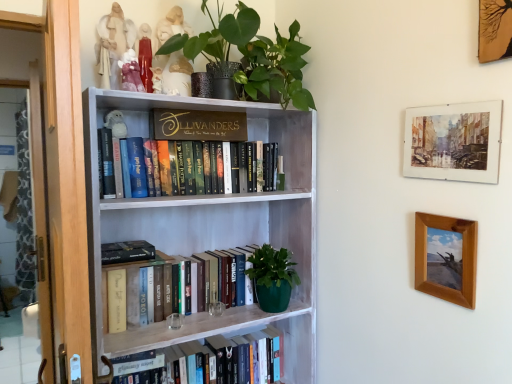
Question: From the image's perspective, is wooden picture frame at upper right, arranged as the 3th picture frame when ordered from the bottom, located beneath matte white figurine at upper left, arranged as the fourth toy when ordered from the bottom?

Choices:
 (A) no
 (B) yes

Answer: (B)

Question: Is wooden picture frame at upper right, arranged as the 3th picture frame when ordered from the bottom, not near matte white figurine at upper left, the 1th toy viewed from the top?

Choices:
 (A) no
 (B) yes

Answer: (B)

Question: Is the depth of wooden picture frame at upper right, which ranks as the first picture frame in top-to-bottom order, less than that of matte white figurine at upper left, arranged as the fourth toy when ordered from the bottom?

Choices:
 (A) no
 (B) yes

Answer: (B)

Question: Considering the relative positions of wooden picture frame at upper right, which ranks as the first picture frame in top-to-bottom order, and matte white figurine at upper left, the 1th toy viewed from the top, in the image provided, is wooden picture frame at upper right, which ranks as the first picture frame in top-to-bottom order, to the right of matte white figurine at upper left, the 1th toy viewed from the top, from the viewer's perspective?

Choices:
 (A) no
 (B) yes

Answer: (B)

Question: Considering the relative sizes of wooden picture frame at upper right, which ranks as the first picture frame in top-to-bottom order, and matte white figurine at upper left, arranged as the fourth toy when ordered from the bottom, in the image provided, is wooden picture frame at upper right, which ranks as the first picture frame in top-to-bottom order, wider than matte white figurine at upper left, arranged as the fourth toy when ordered from the bottom,?

Choices:
 (A) no
 (B) yes

Answer: (A)

Question: Considering the relative sizes of wooden picture frame at upper right, which ranks as the first picture frame in top-to-bottom order, and matte white figurine at upper left, the 1th toy viewed from the top, in the image provided, is wooden picture frame at upper right, which ranks as the first picture frame in top-to-bottom order, thinner than matte white figurine at upper left, the 1th toy viewed from the top,?

Choices:
 (A) no
 (B) yes

Answer: (B)

Question: From a real-world perspective, is porcelain figurine at upper center, which appears as the 3th toy when viewed from the top, below watercolor paper painting at upper right, which appears as the second picture frame when viewed from the top?

Choices:
 (A) yes
 (B) no

Answer: (B)

Question: Can you confirm if porcelain figurine at upper center, marked as the second toy in a bottom-to-top arrangement, is taller than watercolor paper painting at upper right, which appears as the second picture frame when viewed from the top?

Choices:
 (A) no
 (B) yes

Answer: (A)

Question: Is watercolor paper painting at upper right, which appears as the second picture frame when viewed from the top, at the back of porcelain figurine at upper center, which appears as the 3th toy when viewed from the top?

Choices:
 (A) yes
 (B) no

Answer: (B)

Question: From a real-world perspective, is porcelain figurine at upper center, which appears as the 3th toy when viewed from the top, on watercolor paper painting at upper right, the second picture frame from the bottom?

Choices:
 (A) no
 (B) yes

Answer: (B)

Question: Is porcelain figurine at upper center, which appears as the 3th toy when viewed from the top, located outside watercolor paper painting at upper right, the second picture frame from the bottom?

Choices:
 (A) yes
 (B) no

Answer: (A)

Question: Is porcelain figurine at upper center, which appears as the 3th toy when viewed from the top, shorter than watercolor paper painting at upper right, the second picture frame from the bottom?

Choices:
 (A) yes
 (B) no

Answer: (A)

Question: From a real-world perspective, is watercolor paper painting at upper right, the second picture frame from the bottom, under brown wooden picture frame at right, the 3th picture frame viewed from the top?

Choices:
 (A) no
 (B) yes

Answer: (A)